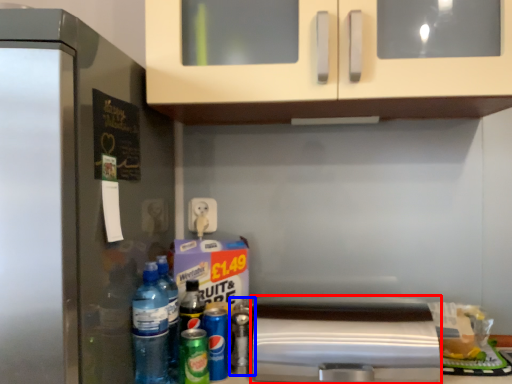
Question: Which point is closer to the camera, appliance (highlighted by a red box) or bottle (highlighted by a blue box)?

Choices:
 (A) appliance
 (B) bottle

Answer: (A)